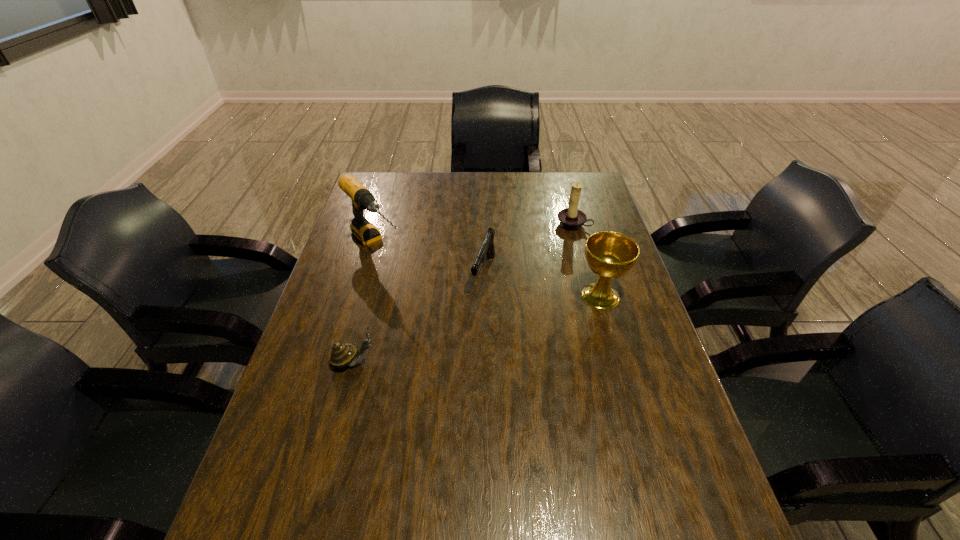
The width and height of the screenshot is (960, 540). I want to click on empty space that is in between the drill and the candle holder, so click(474, 235).

The image size is (960, 540). Find the location of `free space between the gun and the drill`. free space between the gun and the drill is located at coordinates pyautogui.click(x=429, y=259).

Image resolution: width=960 pixels, height=540 pixels. Find the location of `free spot between the gun and the nearest object`. free spot between the gun and the nearest object is located at coordinates (420, 317).

This screenshot has height=540, width=960. Identify the location of unoccupied area between the drill and the candle holder. (474, 235).

Where is `free space between the drill and the candle holder`? This screenshot has width=960, height=540. free space between the drill and the candle holder is located at coordinates (474, 235).

Image resolution: width=960 pixels, height=540 pixels. In order to click on vacant space that's between the drill and the gun in this screenshot , I will do `click(429, 259)`.

Identify which object is located as the second nearest to the chalice. Please provide its 2D coordinates. Your answer should be formatted as a tuple, i.e. [(x, y)], where the tuple contains the x and y coordinates of a point satisfying the conditions above.

[(571, 218)]

Locate which object is the third closest to the drill. Please provide its 2D coordinates. Your answer should be formatted as a tuple, i.e. [(x, y)], where the tuple contains the x and y coordinates of a point satisfying the conditions above.

[(571, 218)]

Find the location of `free space that satisfies the following two spatial constraints: 1. on the front side of the chalice; 2. on the left side of the third object from left to right`. free space that satisfies the following two spatial constraints: 1. on the front side of the chalice; 2. on the left side of the third object from left to right is located at coordinates (484, 296).

The image size is (960, 540). Find the location of `vacant area that satisfies the following two spatial constraints: 1. on the back side of the candle holder; 2. on the right side of the drill`. vacant area that satisfies the following two spatial constraints: 1. on the back side of the candle holder; 2. on the right side of the drill is located at coordinates (381, 224).